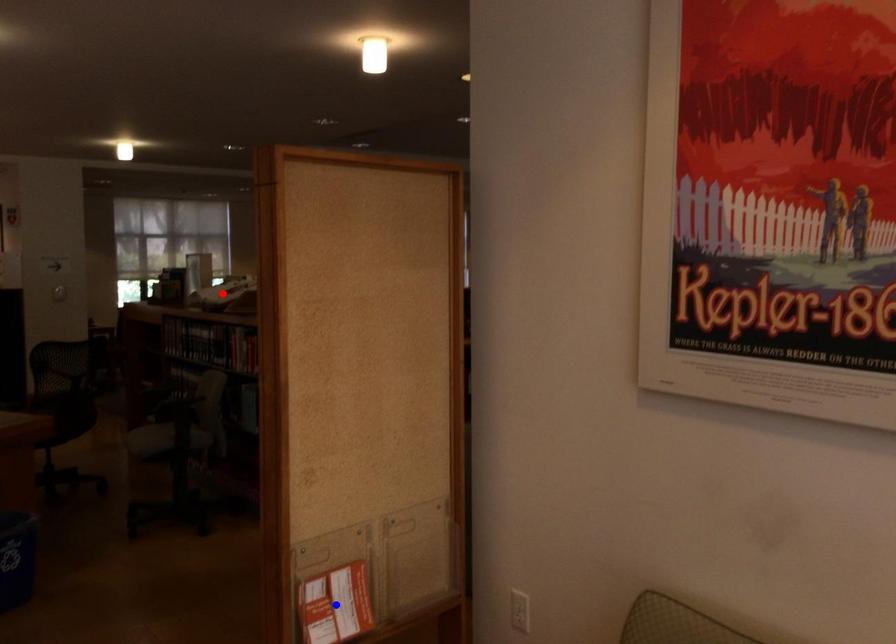
Question: Two points are marked on the image. Which point is closer to the camera?

Choices:
 (A) Blue point is closer.
 (B) Red point is closer.

Answer: (A)